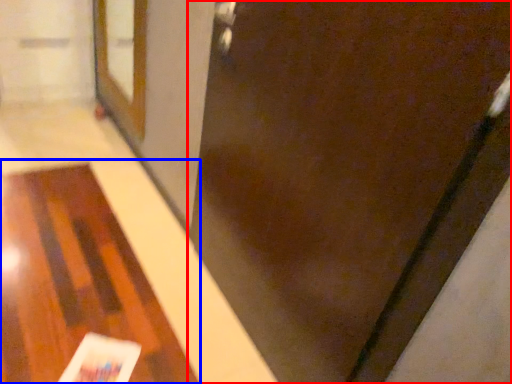
Question: Which object appears closest to the camera in this image, door (highlighted by a red box) or table (highlighted by a blue box)?

Choices:
 (A) door
 (B) table

Answer: (A)